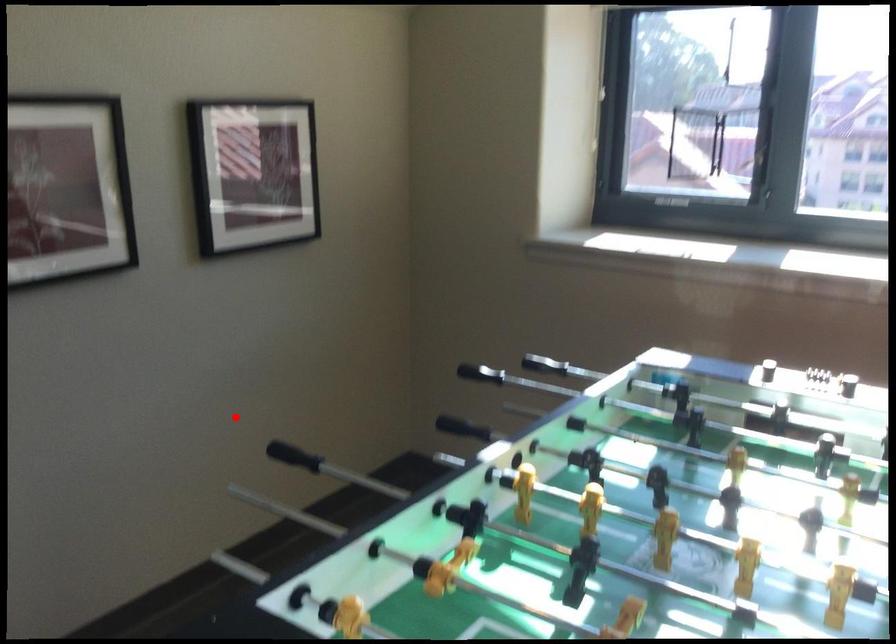
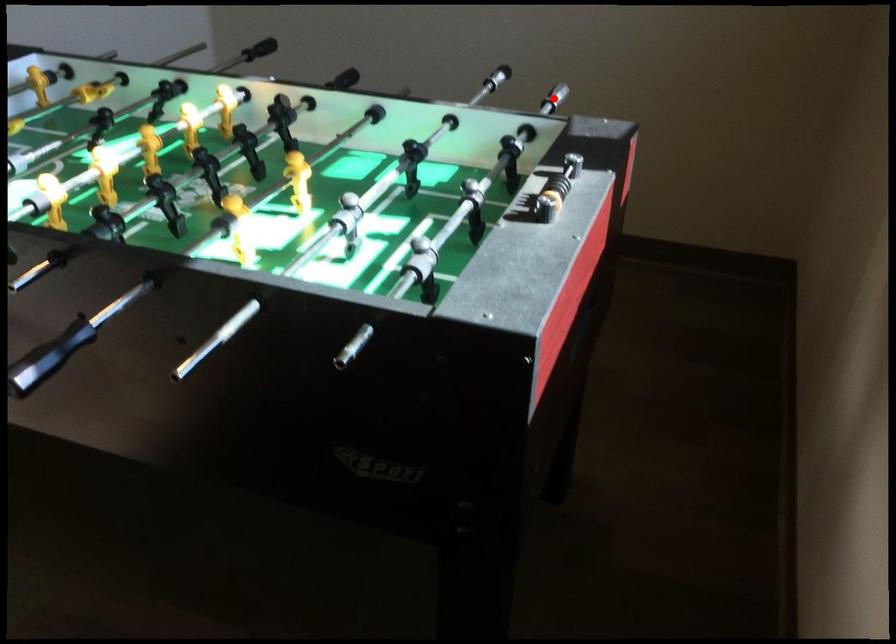
I am providing you with two images of the same scene from different viewpoints. A red point is marked on the first image and another point is marked on the second image. Are the points marked in image1 and image2 representing the same 3D position?

Yes